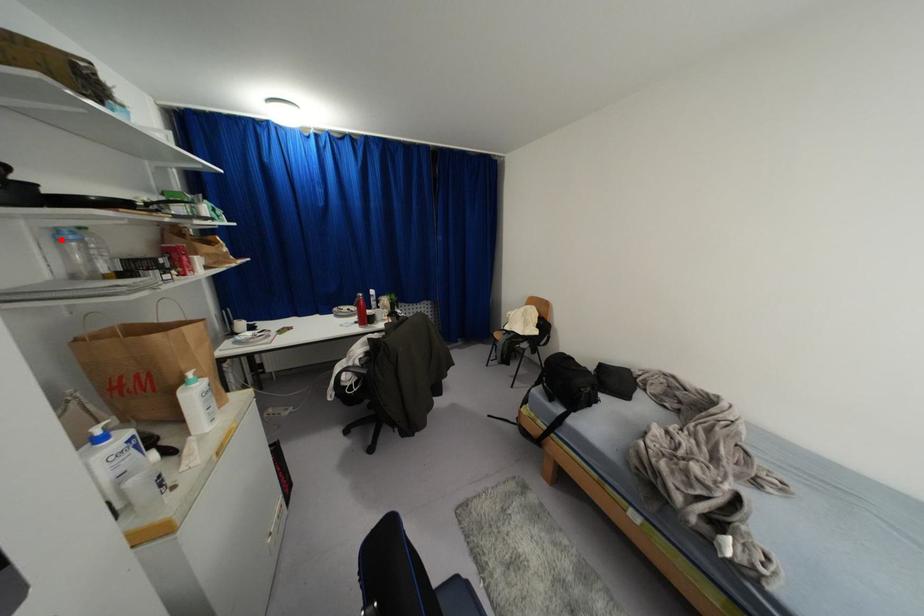
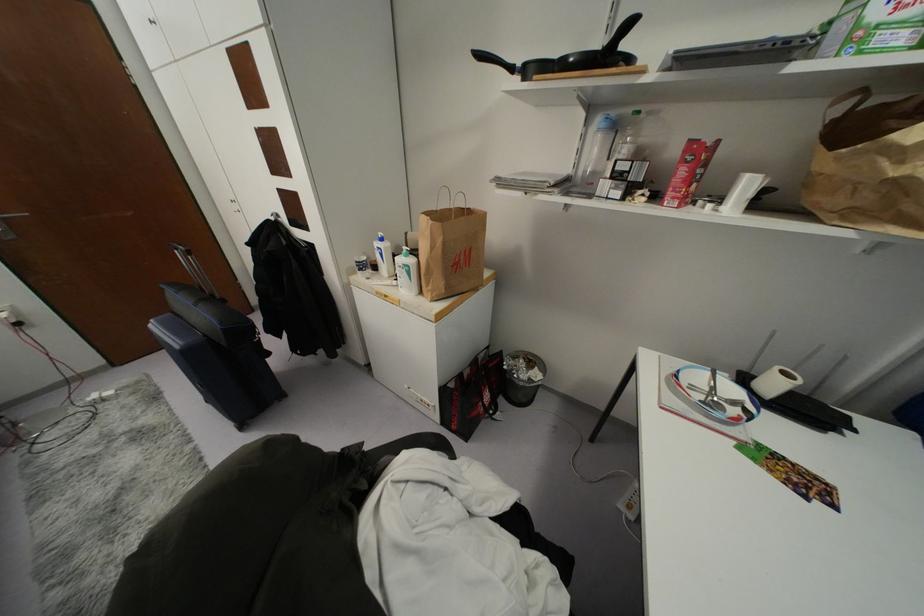
The point at the highlighted location is marked in the first image. Where is the corresponding point in the second image?

(599, 130)